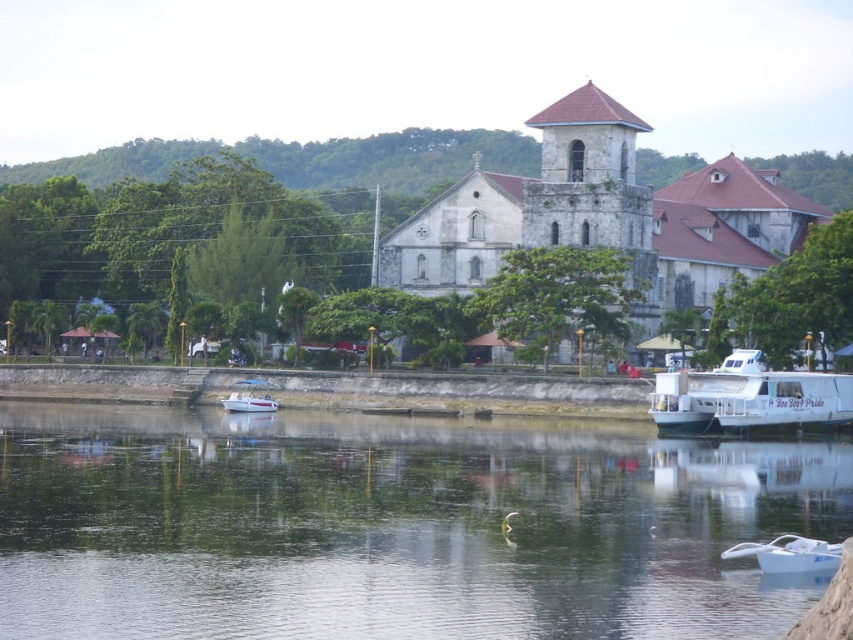
Does white glossy boat at right appear on the left side of white glossy boat at center?

Incorrect, white glossy boat at right is not on the left side of white glossy boat at center.

Is point (749, 374) positioned in front of point (242, 404)?

Yes, it is.

Does point (688, 376) come farther from viewer compared to point (247, 397)?

No.

Locate an element on the screen. white glossy boat at right is located at coordinates (749, 400).

Can you confirm if white stone church at center is thinner than white glossy boat at right?

In fact, white stone church at center might be wider than white glossy boat at right.

Which of these two, white stone church at center or white glossy boat at right, stands taller?

white stone church at center is taller.

Does point (634, 161) come farther from viewer compared to point (682, 387)?

Yes, point (634, 161) is farther from viewer.

Locate an element on the screen. white stone church at center is located at coordinates (602, 214).

How distant is transparent water at lower center from white matte boat at lower right?

The distance of transparent water at lower center from white matte boat at lower right is 81.08 feet.

Can you confirm if transparent water at lower center is positioned to the right of white matte boat at lower right?

Incorrect, transparent water at lower center is not on the right side of white matte boat at lower right.

What do you see at coordinates (395, 525) in the screenshot?
I see `transparent water at lower center` at bounding box center [395, 525].

The width and height of the screenshot is (853, 640). Identify the location of transparent water at lower center. (395, 525).